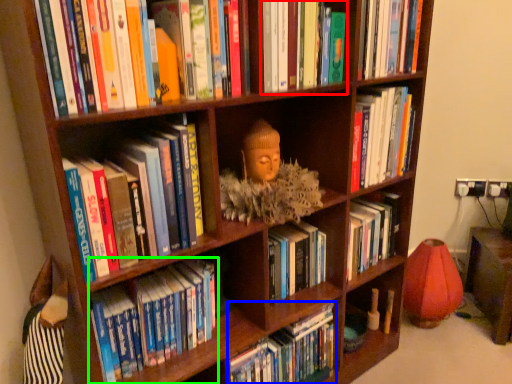
Question: Which object is the farthest from book (highlighted by a red box)? Choose among these: book (highlighted by a blue box) or book (highlighted by a green box).

Choices:
 (A) book
 (B) book

Answer: (A)